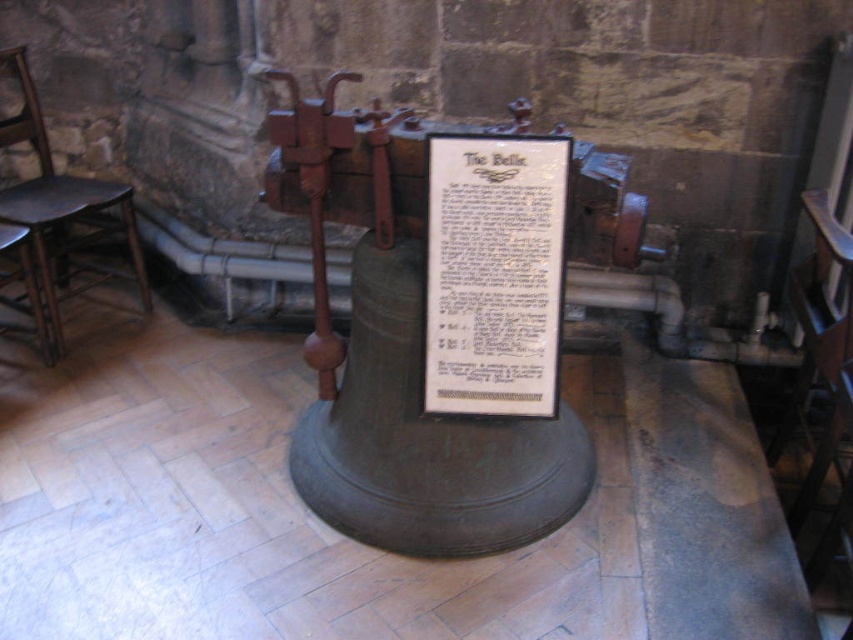
Locate an element on the screen. The image size is (853, 640). white paper at center is located at coordinates (494, 273).

Does white paper at center have a larger size compared to dark brown wooden chair at left?

Incorrect, white paper at center is not larger than dark brown wooden chair at left.

Does point (550, 397) come farther from viewer compared to point (39, 145)?

No, it is not.

The width and height of the screenshot is (853, 640). In order to click on white paper at center in this screenshot , I will do `click(494, 273)`.